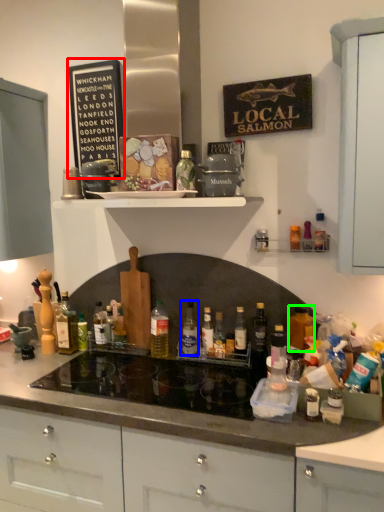
Question: Which object is the farthest from bulletin board (highlighted by a red box)? Choose among these: bottle (highlighted by a blue box) or bottle (highlighted by a green box).

Choices:
 (A) bottle
 (B) bottle

Answer: (B)